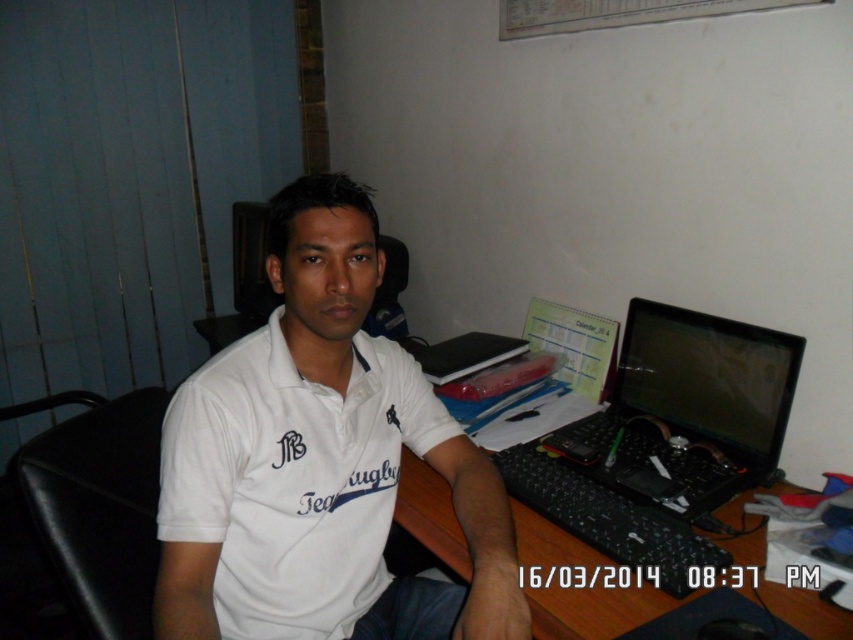
Can you confirm if black leather chair at left is wider than black plastic laptop at right?

In fact, black leather chair at left might be narrower than black plastic laptop at right.

Does black leather chair at left appear over black plastic laptop at right?

Actually, black leather chair at left is below black plastic laptop at right.

Who is more forward, (x=94, y=557) or (x=799, y=337)?

Point (x=94, y=557) is in front.

The width and height of the screenshot is (853, 640). Find the location of `black leather chair at left`. black leather chair at left is located at coordinates (99, 509).

Between black leather chair at left and wooden desk at center, which one appears on the left side from the viewer's perspective?

black leather chair at left is more to the left.

Can you confirm if black leather chair at left is positioned to the left of wooden desk at center?

Indeed, black leather chair at left is positioned on the left side of wooden desk at center.

Image resolution: width=853 pixels, height=640 pixels. What are the coordinates of `black leather chair at left` in the screenshot? It's located at (99, 509).

Between white cotton shirt at center and wooden desk at center, which one is positioned lower?

wooden desk at center is below.

Which is behind, point (193, 596) or point (434, 488)?

The point (434, 488) is more distant.

Where is `white cotton shirt at center`? white cotton shirt at center is located at coordinates (318, 461).